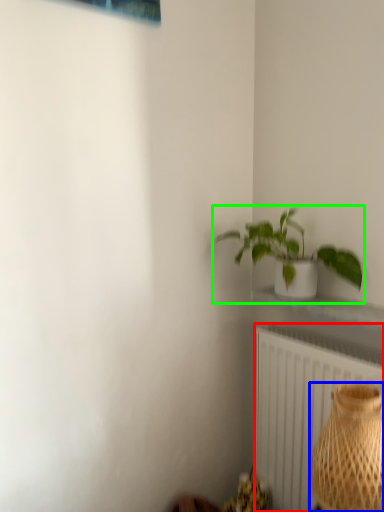
Question: Which object is positioned closest to radiator (highlighted by a red box)? Select from vase (highlighted by a blue box) and houseplant (highlighted by a green box).

Choices:
 (A) vase
 (B) houseplant

Answer: (A)